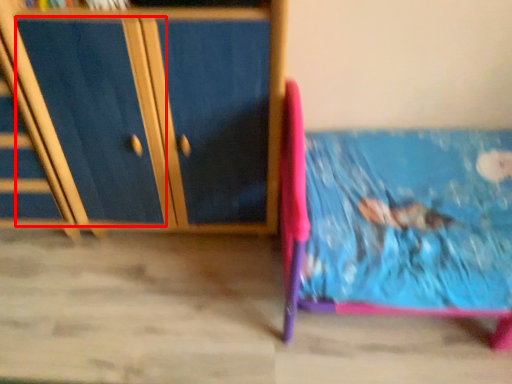
Question: In this image, where is drawer (annotated by the red box) located relative to furniture?

Choices:
 (A) left
 (B) right

Answer: (A)